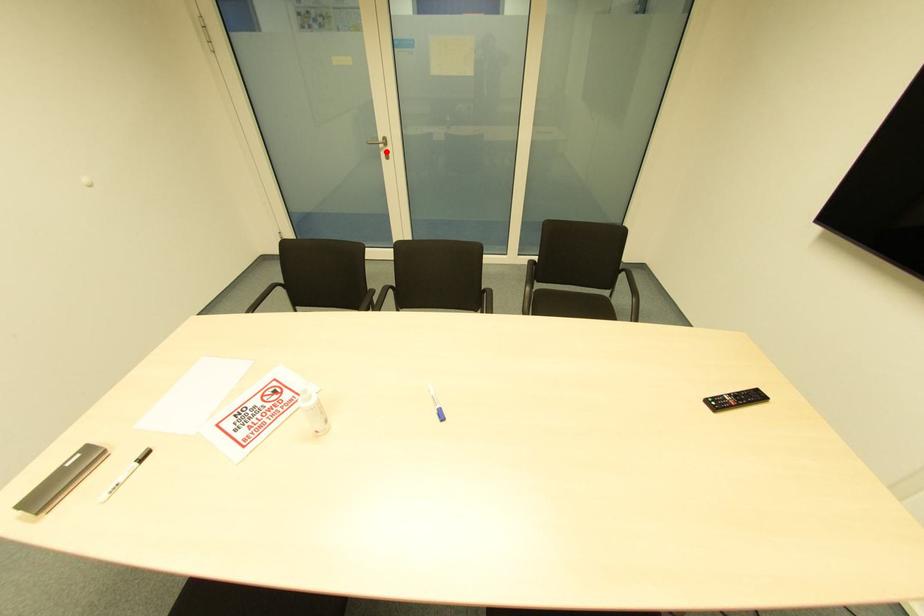
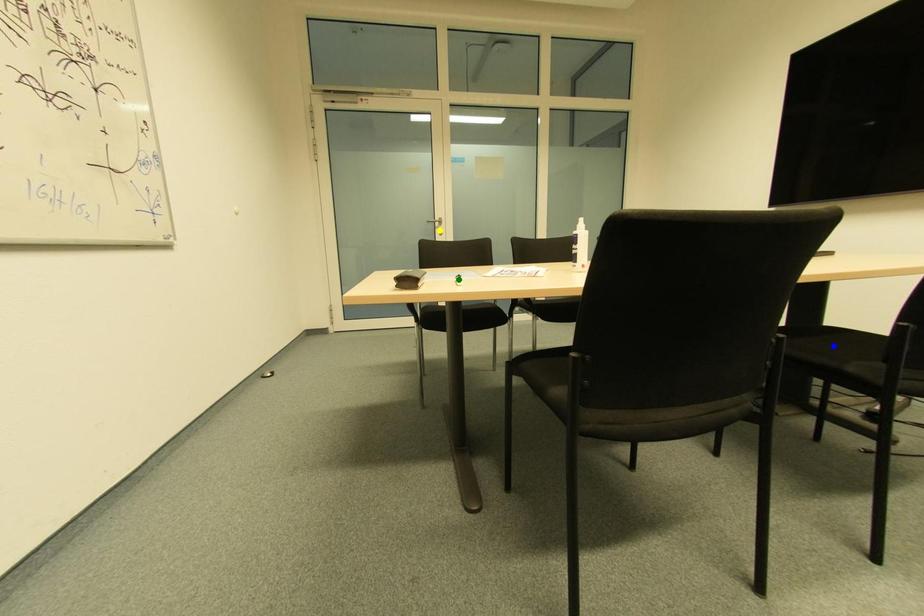
Question: I am providing you with two images of the same scene from different viewpoints. A red point is marked on the first image. You are given multiple points on the second image. Can you choose the point in image 2 that corresponds to the point in image 1?

Choices:
 (A) blue point
 (B) yellow point
 (C) green point

Answer: (B)